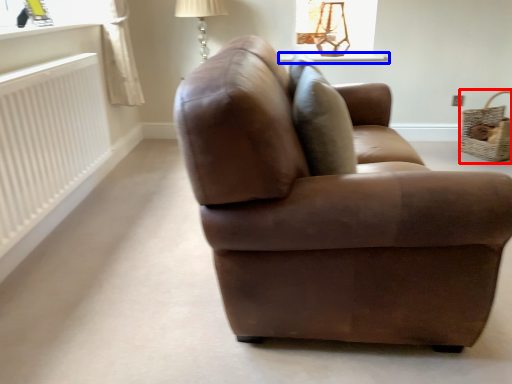
Question: Which point is closer to the camera, basket (highlighted by a red box) or window sill (highlighted by a blue box)?

Choices:
 (A) basket
 (B) window sill

Answer: (A)